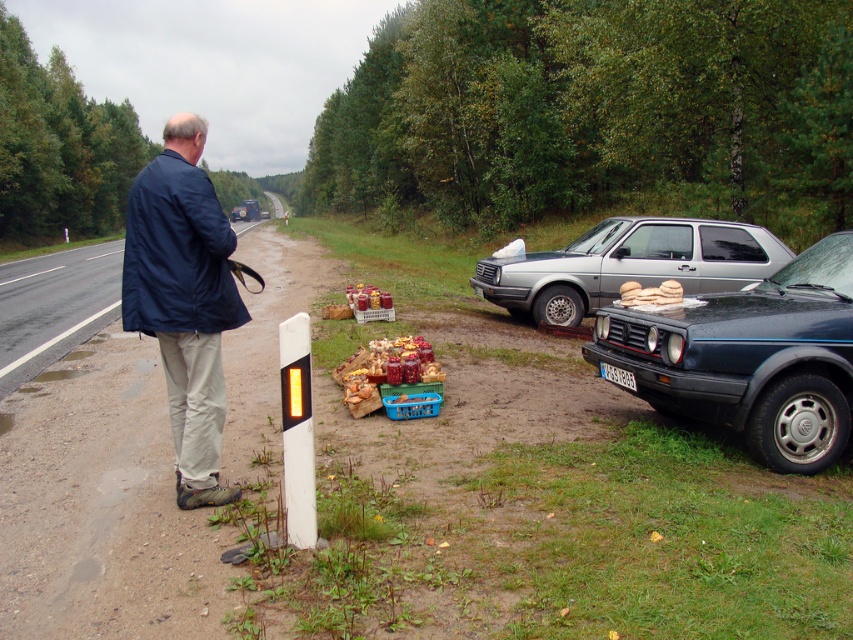
You are a hiker who has just finished a long trek and is standing at the roadside scene described. You need to place your dark blue fabric jacket at left on the ground. Considering the scene, where would be the most appropriate spot to place it?

The most appropriate spot to place the dark blue fabric jacket at left would be on the ground near the parked cars on the right side of the image, as they are positioned on a patch of grass where items can be placed safely without obstructing the road.

You are a delivery person who needs to place a large package on the road. You see the dark blue fabric jacket at left and the shiny metallic jars at center. Which object is taller and should you avoid placing the package near to prevent it from being hidden?

The dark blue fabric jacket at left is much taller than the shiny metallic jars at center, so you should avoid placing the package near the dark blue fabric jacket at left to prevent it from being hidden.

You are standing at point A and want to walk to point B. Which direction should you go if point A is at point [370,390] and point B is at point [598,224]?

To move from point A at [370,390] to point B at [598,224], you should walk towards the lower left direction since point B is behind point A in the image.